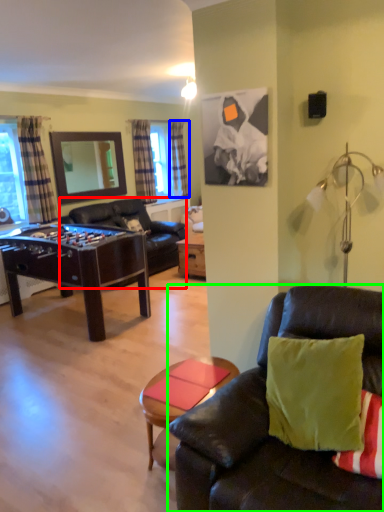
Question: Which object is positioned farthest from studio couch (highlighted by a red box)? Select from curtain (highlighted by a blue box) and studio couch (highlighted by a green box).

Choices:
 (A) curtain
 (B) studio couch

Answer: (B)